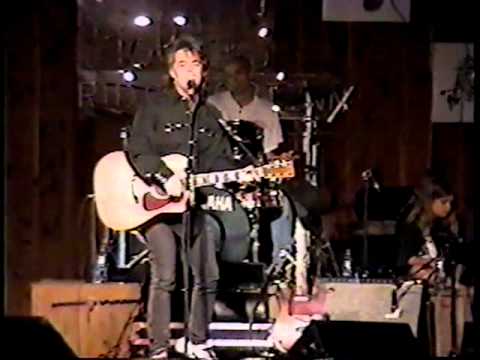
Image resolution: width=480 pixels, height=360 pixels. Find the location of `wall`. wall is located at coordinates (63, 205).